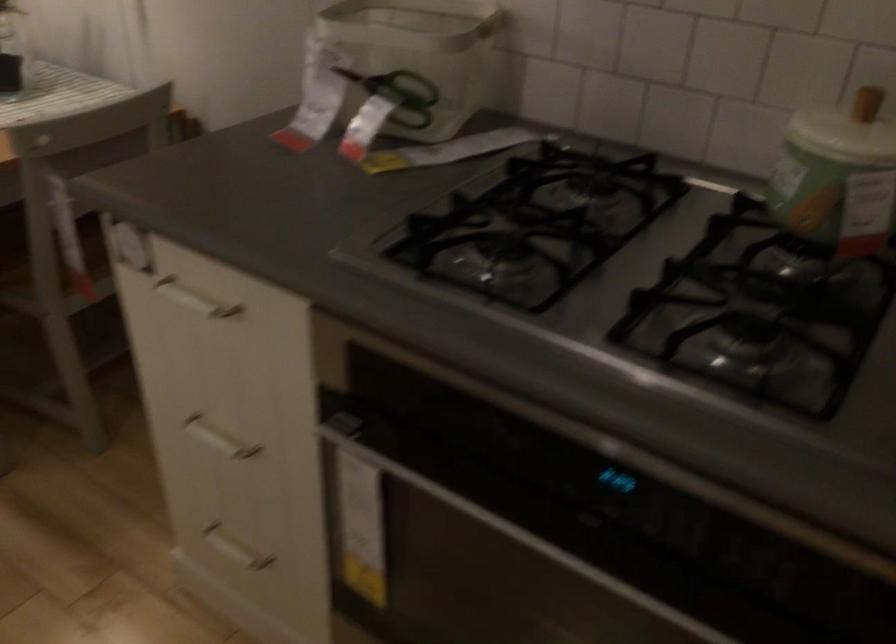
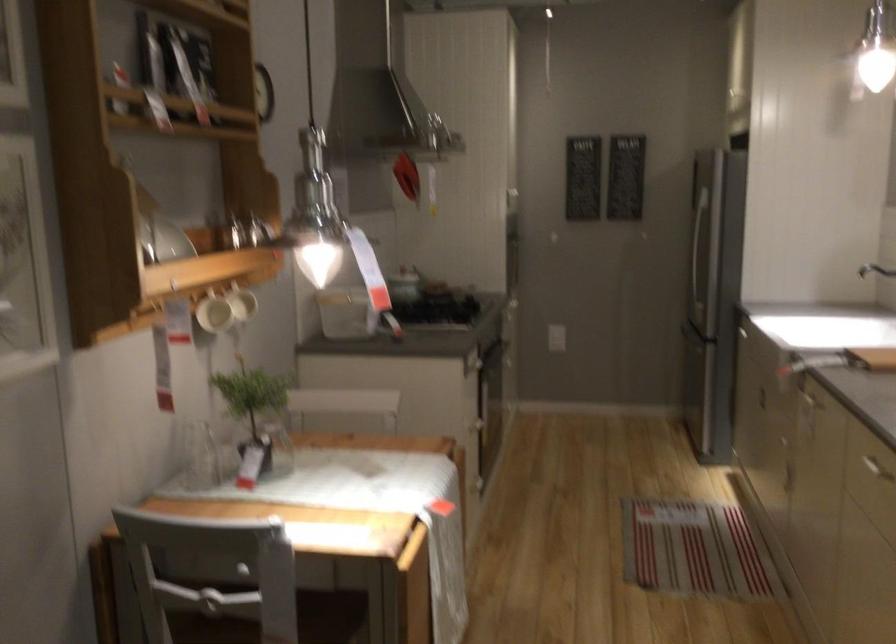
Question: I am providing you with two images of the same scene from different viewpoints. Which of the following objects are not visible in image2?

Choices:
 (A) white mug handle
 (B) chair sitting surface
 (C) white control panel
 (D) sink faucet handle

Answer: (B)